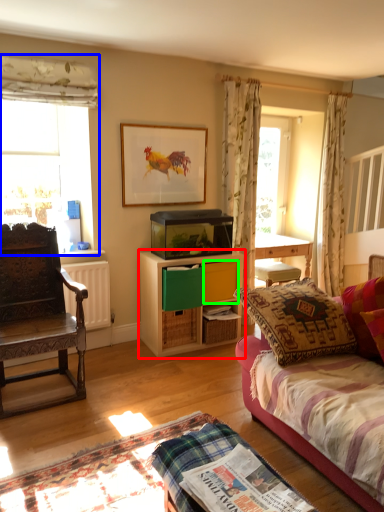
Question: Which object is the closest to the cabinetry (highlighted by a red box)? Choose among these: window (highlighted by a blue box) or drawer (highlighted by a green box).

Choices:
 (A) window
 (B) drawer

Answer: (B)